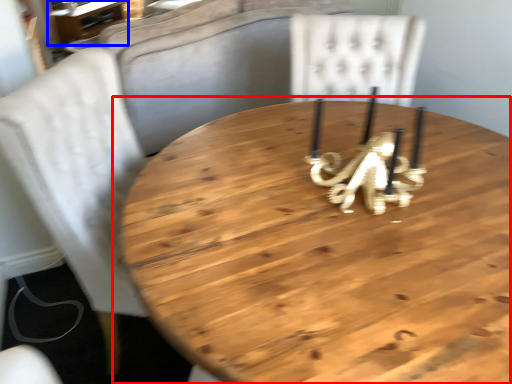
Question: Which point is further to the camera, table (highlighted by a red box) or table (highlighted by a blue box)?

Choices:
 (A) table
 (B) table

Answer: (B)